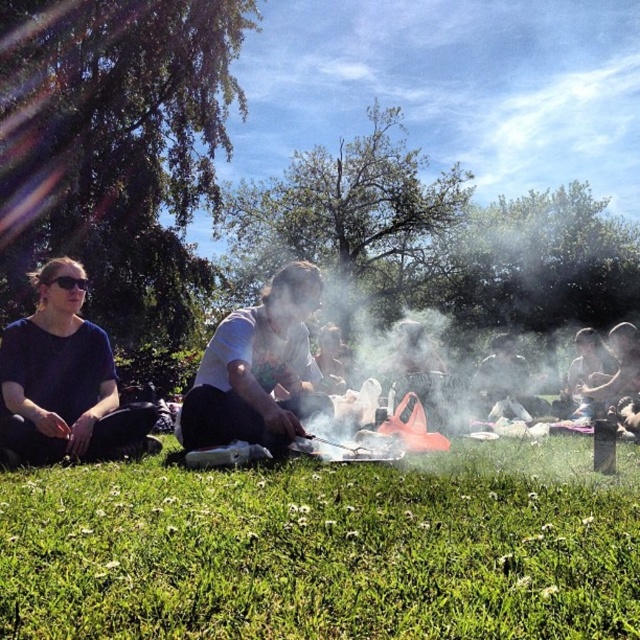
Is green grass at lower center taller than white matte grill at center?

In fact, green grass at lower center may be shorter than white matte grill at center.

Between green grass at lower center and white matte grill at center, which one appears on the right side from the viewer's perspective?

From the viewer's perspective, green grass at lower center appears more on the right side.

What are the coordinates of `green grass at lower center` in the screenshot? It's located at (326, 548).

Based on the photo, which is more to the left, matte black shirt at left or white matte grill at center?

matte black shirt at left

Does matte black shirt at left appear on the right side of white matte grill at center?

No, matte black shirt at left is not to the right of white matte grill at center.

What do you see at coordinates (61, 380) in the screenshot? I see `matte black shirt at left` at bounding box center [61, 380].

In order to click on matte black shirt at left in this screenshot , I will do `click(61, 380)`.

Can you confirm if green grass at lower center is positioned to the left of matte black shirt at left?

In fact, green grass at lower center is to the right of matte black shirt at left.

Who is more forward, (97, 595) or (100, 362)?

Positioned in front is point (97, 595).

Identify the location of green grass at lower center. (326, 548).

Find the location of a particular element. This screenshot has width=640, height=640. green grass at lower center is located at coordinates pos(326,548).